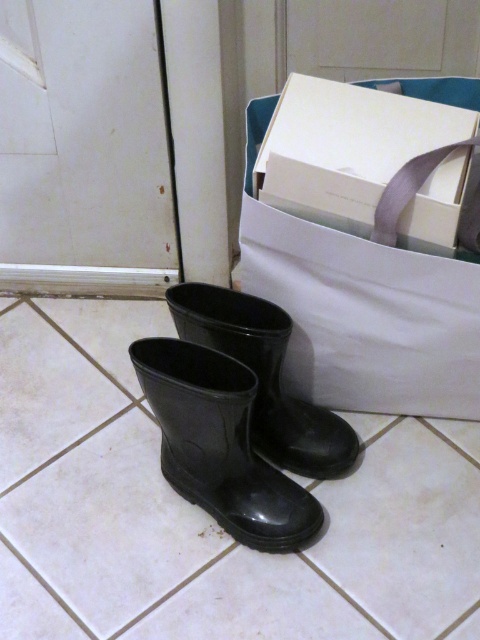
You are standing in a room with a white door and a teal object in the background. You need to place a new boot exactly where the black rubber boot at lower center is currently located. What coordinates should you use to position it?

You should position the new boot at coordinates point (x=219, y=445) where the black rubber boot at lower center is currently located.

You are standing in a room and want to reach the white cardboard box at upper right. The boots are in your way. If you move the boots aside, will you be able to reach the box without moving further forward?

The white cardboard box at upper right is 94.90 centimeters away from the viewer. Since moving the boots aside would only clear the path but not reduce the distance, you would still need to move forward to reach it.

You are organizing items in a storage room and see the black rubber boot at lower center and the glossy rubber boot at center. Which boot is positioned lower on the floor?

The black rubber boot at lower center is positioned lower on the floor than the glossy rubber boot at center.